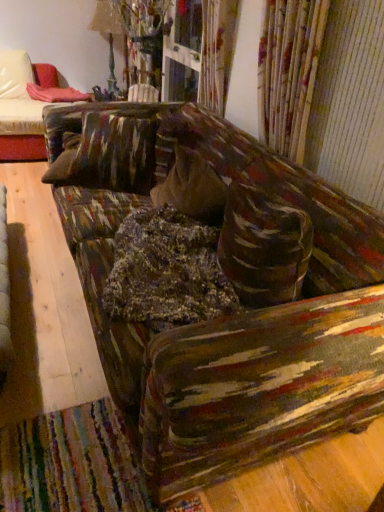
What is the approximate height of textured multicolored couch at center?

The height of textured multicolored couch at center is 1.76 inches.

Describe the element at coordinates (234, 286) in the screenshot. The width and height of the screenshot is (384, 512). I see `textured multicolored couch at center` at that location.

Identify the location of textured multicolored couch at center. The width and height of the screenshot is (384, 512). (234, 286).

The image size is (384, 512). What do you see at coordinates (56, 94) in the screenshot?
I see `pink fabric at upper left` at bounding box center [56, 94].

I want to click on pink fabric at upper left, so click(x=56, y=94).

In order to click on textured multicolored couch at center in this screenshot , I will do `click(234, 286)`.

Which is more to the right, pink fabric at upper left or textured multicolored couch at center?

Positioned to the right is textured multicolored couch at center.

Which object is further away from the camera, pink fabric at upper left or textured multicolored couch at center?

pink fabric at upper left is behind.

Is point (29, 87) in front of point (183, 391)?

No, (29, 87) is further to viewer.

Based on the photo, from the image's perspective, would you say pink fabric at upper left is shown under textured multicolored couch at center?

No.

From a real-world perspective, is pink fabric at upper left located higher than textured multicolored couch at center?

Correct, in the physical world, pink fabric at upper left is higher than textured multicolored couch at center.

Between pink fabric at upper left and textured multicolored couch at center, which one has smaller width?

pink fabric at upper left.

In terms of height, does pink fabric at upper left look taller or shorter compared to textured multicolored couch at center?

pink fabric at upper left is taller than textured multicolored couch at center.

Which of these two, pink fabric at upper left or textured multicolored couch at center, is bigger?

textured multicolored couch at center is bigger.

Is pink fabric at upper left spatially inside textured multicolored couch at center, or outside of it?

pink fabric at upper left is outside textured multicolored couch at center.

Is pink fabric at upper left not near textured multicolored couch at center?

Yes, pink fabric at upper left is far from textured multicolored couch at center.

Is pink fabric at upper left facing away from textured multicolored couch at center?

No, pink fabric at upper left is not facing the opposite direction of textured multicolored couch at center.

At what (x,y) coordinates should I click in order to perform the action: click on blanket on the left of the textured multicolored couch at center. Please return your answer as a coordinate pair (x, y). Image resolution: width=384 pixels, height=512 pixels. Looking at the image, I should click on (56, 94).

Can you confirm if textured multicolored couch at center is positioned to the left of pink fabric at upper left?

Incorrect, textured multicolored couch at center is not on the left side of pink fabric at upper left.

Which is in front, textured multicolored couch at center or pink fabric at upper left?

textured multicolored couch at center is more forward.

Considering the points (282, 383) and (84, 100), which point is behind, point (282, 383) or point (84, 100)?

The point (84, 100) is more distant.

From the image's perspective, is textured multicolored couch at center above or below pink fabric at upper left?

textured multicolored couch at center is situated lower than pink fabric at upper left in the image.

From a real-world perspective, which is physically above, textured multicolored couch at center or pink fabric at upper left?

pink fabric at upper left, from a real-world perspective.

Looking at this image, can you confirm if textured multicolored couch at center is thinner than pink fabric at upper left?

Incorrect, the width of textured multicolored couch at center is not less than that of pink fabric at upper left.

Is textured multicolored couch at center taller than pink fabric at upper left?

No.

Considering the sizes of objects textured multicolored couch at center and pink fabric at upper left in the image provided, who is bigger, textured multicolored couch at center or pink fabric at upper left?

With larger size is textured multicolored couch at center.

Is textured multicolored couch at center completely or partially outside of pink fabric at upper left?

textured multicolored couch at center is positioned outside pink fabric at upper left.

Would you consider textured multicolored couch at center to be distant from pink fabric at upper left?

Absolutely, textured multicolored couch at center is distant from pink fabric at upper left.

Is textured multicolored couch at center facing away from pink fabric at upper left?

No, pink fabric at upper left is not at the back of textured multicolored couch at center.

Can you tell me how much textured multicolored couch at center and pink fabric at upper left differ in facing direction?

There is a 119-degree angle between the facing directions of textured multicolored couch at center and pink fabric at upper left.

Measure the distance from textured multicolored couch at center to pink fabric at upper left.

The distance of textured multicolored couch at center from pink fabric at upper left is 2.16 meters.

Image resolution: width=384 pixels, height=512 pixels. What are the coordinates of `blanket on the left of the textured multicolored couch at center` in the screenshot? It's located at (56, 94).

Image resolution: width=384 pixels, height=512 pixels. In order to click on blanket above the textured multicolored couch at center (from a real-world perspective) in this screenshot , I will do `click(56, 94)`.

Identify the location of blanket behind the textured multicolored couch at center. The image size is (384, 512). (56, 94).